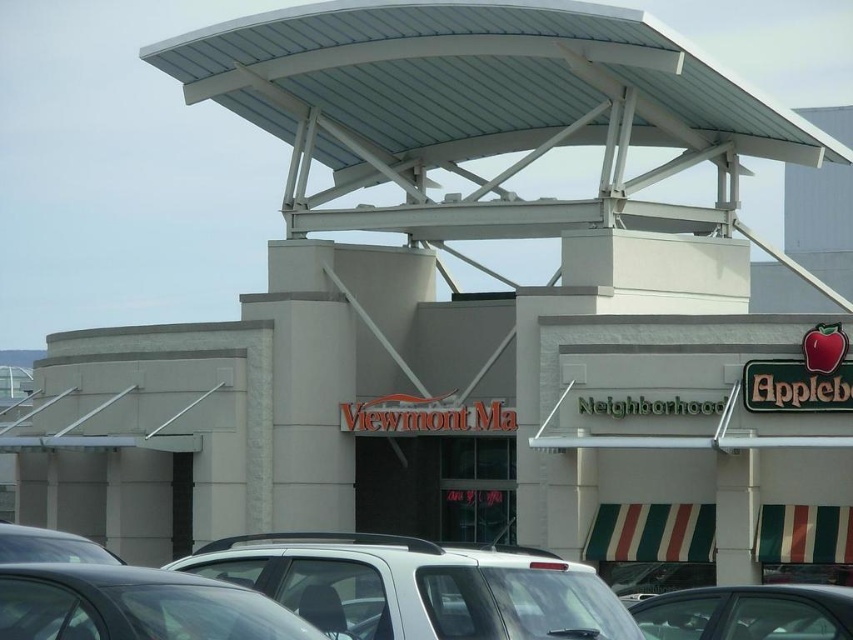
Is shiny black car at lower left further to camera compared to metallic silver car at center?

No, it is not.

Is point (13, 582) positioned after point (784, 632)?

No, (13, 582) is closer to viewer.

Image resolution: width=853 pixels, height=640 pixels. Find the location of `shiny black car at lower left`. shiny black car at lower left is located at coordinates coord(135,605).

Measure the distance between point (389, 541) and camera.

They are 109.93 feet apart.

Which of these two, white matte suv at center or metallic silver car at center, stands taller?

Standing taller between the two is white matte suv at center.

The height and width of the screenshot is (640, 853). What are the coordinates of `white matte suv at center` in the screenshot? It's located at (416, 586).

Locate an element on the screen. white matte suv at center is located at coordinates (416, 586).

Is white matte suv at center shorter than shiny black car at lower left?

Incorrect, white matte suv at center's height does not fall short of shiny black car at lower left's.

This screenshot has width=853, height=640. What do you see at coordinates (416, 586) in the screenshot?
I see `white matte suv at center` at bounding box center [416, 586].

Identify the location of white matte suv at center. (416, 586).